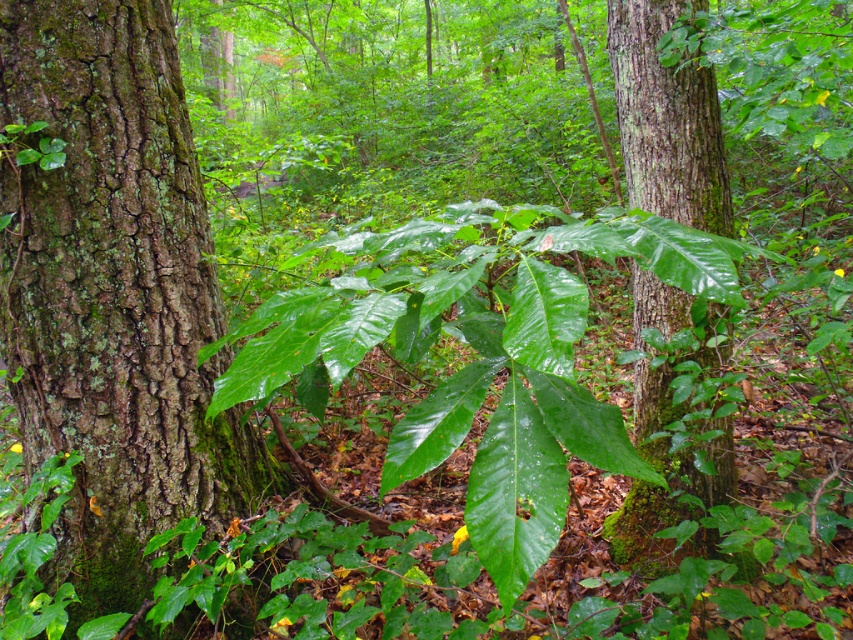
Question: Can you confirm if green mossy bark at center is positioned to the right of green leafy tree at center?

Choices:
 (A) no
 (B) yes

Answer: (A)

Question: Which object is closer to the camera taking this photo?

Choices:
 (A) green mossy bark at center
 (B) green leafy tree at center

Answer: (A)

Question: Which of the following is the closest to the observer?

Choices:
 (A) green mossy bark at center
 (B) green leafy tree at center

Answer: (A)

Question: Can you confirm if green mossy bark at center is positioned to the right of green leafy tree at center?

Choices:
 (A) no
 (B) yes

Answer: (A)

Question: Does green mossy bark at center have a lesser width compared to green leafy tree at center?

Choices:
 (A) yes
 (B) no

Answer: (B)

Question: Which of the following is the farthest from the observer?

Choices:
 (A) pyautogui.click(x=120, y=76)
 (B) pyautogui.click(x=650, y=380)

Answer: (B)